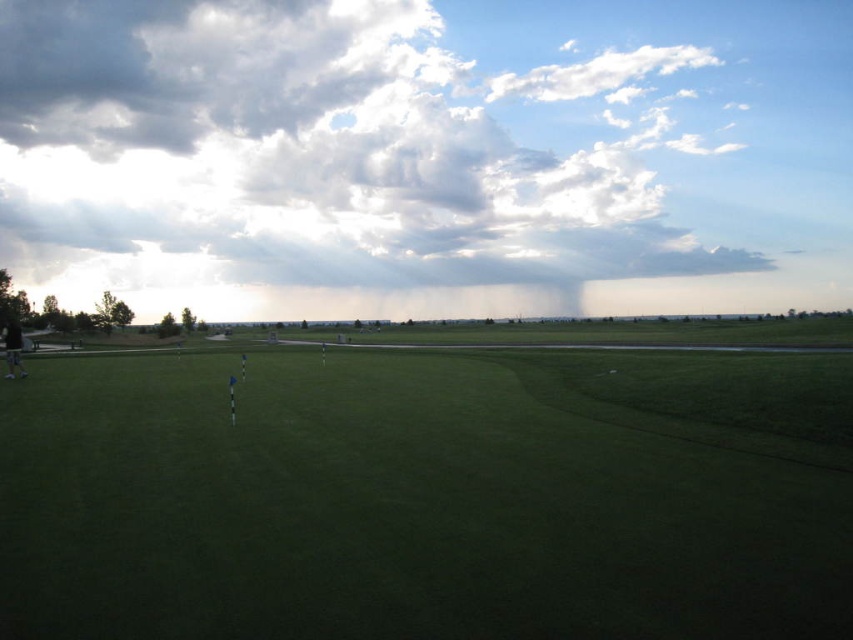
Is green grassy field at center wider than cloudy sky at upper center?

In fact, green grassy field at center might be narrower than cloudy sky at upper center.

The image size is (853, 640). What do you see at coordinates (428, 497) in the screenshot?
I see `green grassy field at center` at bounding box center [428, 497].

Between point (764, 401) and point (310, 291), which one is positioned in front?

Point (764, 401) is in front.

You are a GUI agent. You are given a task and a screenshot of the screen. Output one action in this format:
    pyautogui.click(x=<x>, y=<y>)
    Task: Click on the green grassy field at center
    
    Given the screenshot: What is the action you would take?
    (428, 497)